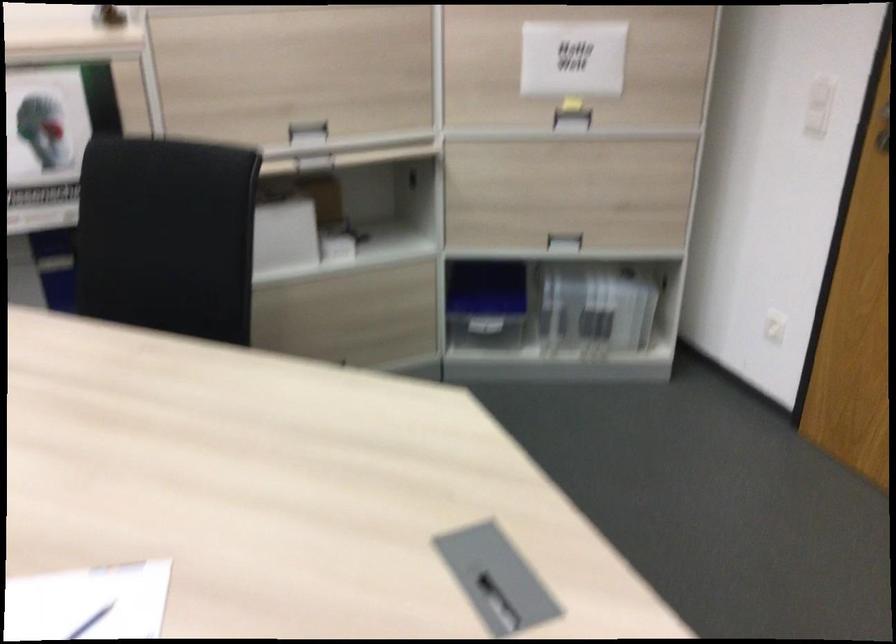
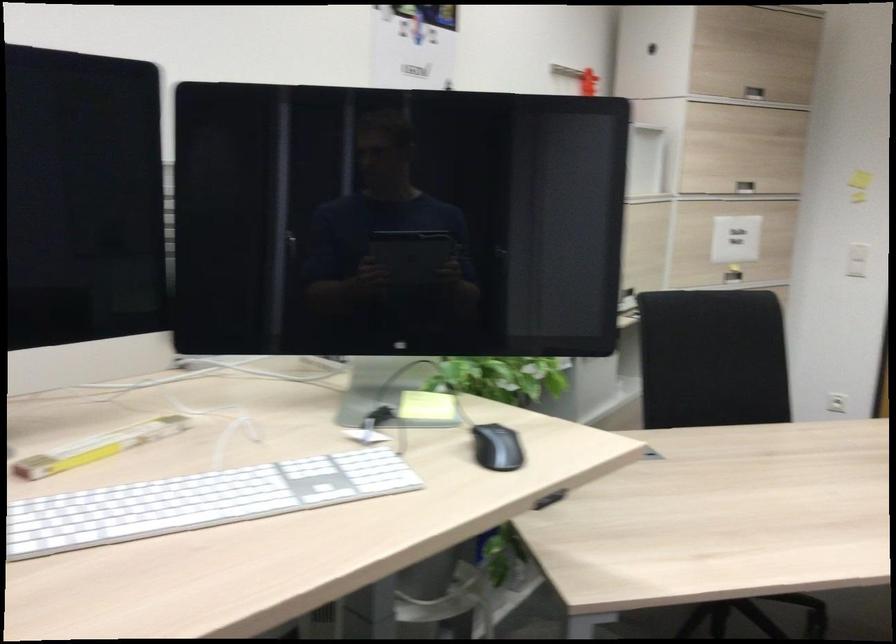
Locate, in the second image, the point that corresponds to point (536, 116) in the first image.

(733, 275)